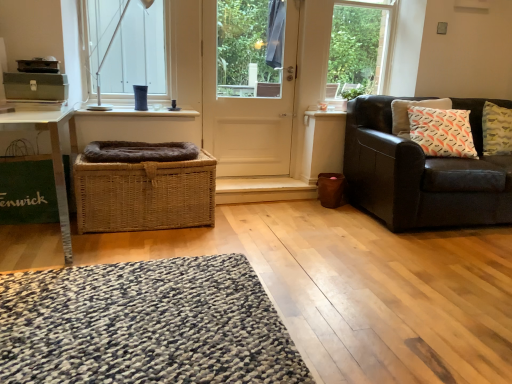
Question: Could dark brown leather couch at right be considered to be inside white matte door at center?

Choices:
 (A) yes
 (B) no

Answer: (B)

Question: Considering the relative sizes of white matte door at center and dark brown leather couch at right in the image provided, is white matte door at center wider than dark brown leather couch at right?

Choices:
 (A) no
 (B) yes

Answer: (A)

Question: Considering the relative sizes of white matte door at center and dark brown leather couch at right in the image provided, is white matte door at center taller than dark brown leather couch at right?

Choices:
 (A) yes
 (B) no

Answer: (A)

Question: Is white matte door at center not inside dark brown leather couch at right?

Choices:
 (A) yes
 (B) no

Answer: (A)

Question: Is white matte door at center not near dark brown leather couch at right?

Choices:
 (A) yes
 (B) no

Answer: (A)

Question: Is textured gray mat at lower left taller or shorter than white glossy window sill at upper center?

Choices:
 (A) tall
 (B) short

Answer: (B)

Question: Considering the positions of textured gray mat at lower left and white glossy window sill at upper center in the image, is textured gray mat at lower left wider or thinner than white glossy window sill at upper center?

Choices:
 (A) thin
 (B) wide

Answer: (B)

Question: Considering the positions of textured gray mat at lower left and white glossy window sill at upper center in the image, is textured gray mat at lower left bigger or smaller than white glossy window sill at upper center?

Choices:
 (A) big
 (B) small

Answer: (A)

Question: Would you say textured gray mat at lower left is to the left or to the right of white glossy window sill at upper center in the picture?

Choices:
 (A) left
 (B) right

Answer: (B)

Question: From a real-world perspective, is textured gray mat at lower left physically located above or below white glass window at upper left?

Choices:
 (A) below
 (B) above

Answer: (A)

Question: Looking at the image, does textured gray mat at lower left seem bigger or smaller compared to white glass window at upper left?

Choices:
 (A) big
 (B) small

Answer: (B)

Question: From the image's perspective, is textured gray mat at lower left above or below white glass window at upper left?

Choices:
 (A) below
 (B) above

Answer: (A)

Question: Based on their positions, is textured gray mat at lower left located to the left or right of white glass window at upper left?

Choices:
 (A) left
 (B) right

Answer: (B)

Question: Relative to dark brown leather couch at right, is textured gray mat at lower left in front or behind?

Choices:
 (A) behind
 (B) front

Answer: (B)

Question: From their relative heights in the image, would you say textured gray mat at lower left is taller or shorter than dark brown leather couch at right?

Choices:
 (A) short
 (B) tall

Answer: (A)